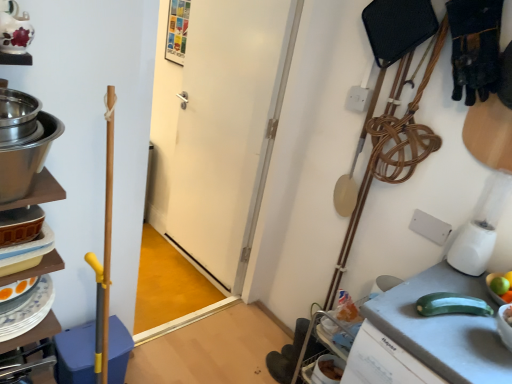
Question: From a real-world perspective, is green matte apple at right on stainless steel bowls at left?

Choices:
 (A) yes
 (B) no

Answer: (B)

Question: From a real-world perspective, does green matte apple at right sit lower than stainless steel bowls at left?

Choices:
 (A) yes
 (B) no

Answer: (A)

Question: Would you say green matte apple at right is a long distance from stainless steel bowls at left?

Choices:
 (A) no
 (B) yes

Answer: (B)

Question: Does green matte apple at right have a greater height compared to stainless steel bowls at left?

Choices:
 (A) yes
 (B) no

Answer: (B)

Question: Is green matte apple at right looking in the opposite direction of stainless steel bowls at left?

Choices:
 (A) yes
 (B) no

Answer: (B)

Question: Could you tell me if green matte apple at right is facing stainless steel bowls at left?

Choices:
 (A) yes
 (B) no

Answer: (B)

Question: Considering the relative sizes of white matte door at center and green matte apple at right in the image provided, is white matte door at center smaller than green matte apple at right?

Choices:
 (A) no
 (B) yes

Answer: (A)

Question: Could you tell me if white matte door at center is facing green matte apple at right?

Choices:
 (A) no
 (B) yes

Answer: (A)

Question: Can you confirm if white matte door at center is bigger than green matte apple at right?

Choices:
 (A) no
 (B) yes

Answer: (B)

Question: From a real-world perspective, does white matte door at center stand above green matte apple at right?

Choices:
 (A) no
 (B) yes

Answer: (A)

Question: Is white matte door at center wider than green matte apple at right?

Choices:
 (A) no
 (B) yes

Answer: (B)

Question: Considering the relative sizes of white matte door at center and green matte apple at right in the image provided, is white matte door at center thinner than green matte apple at right?

Choices:
 (A) yes
 (B) no

Answer: (B)

Question: Is white matte door at center not within green matte zucchini at lower right?

Choices:
 (A) no
 (B) yes

Answer: (B)